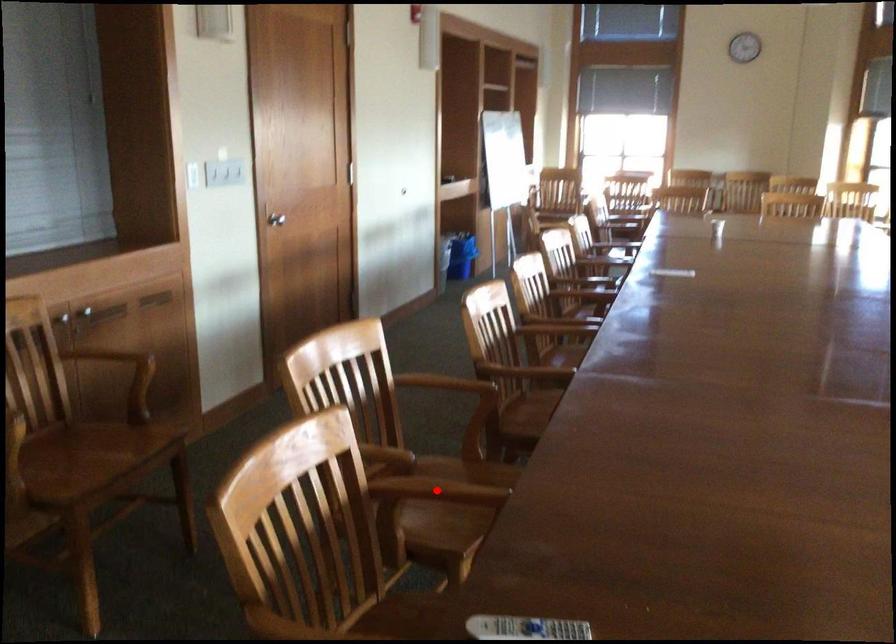
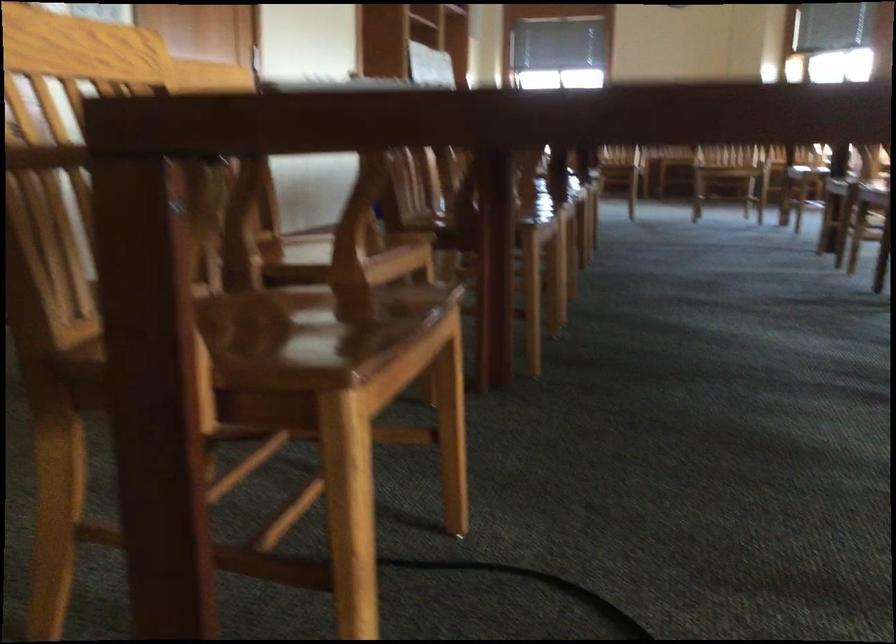
Question: I am providing you with two images of the same scene from different viewpoints. A red point is marked on the first image. Is the red point's position out of view in image 2?

Choices:
 (A) Yes
 (B) No

Answer: (A)